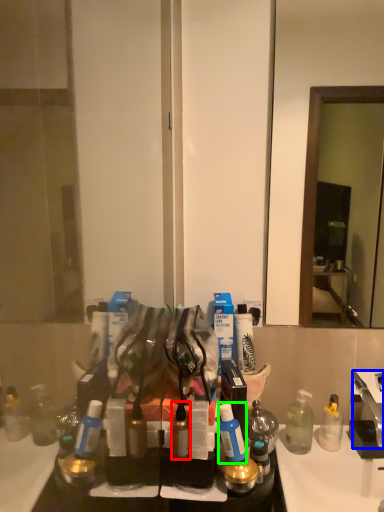
Question: Considering the real-world distances, which object is farthest from toiletry (highlighted by a red box)? faucet (highlighted by a blue box) or toiletry (highlighted by a green box)?

Choices:
 (A) faucet
 (B) toiletry

Answer: (A)